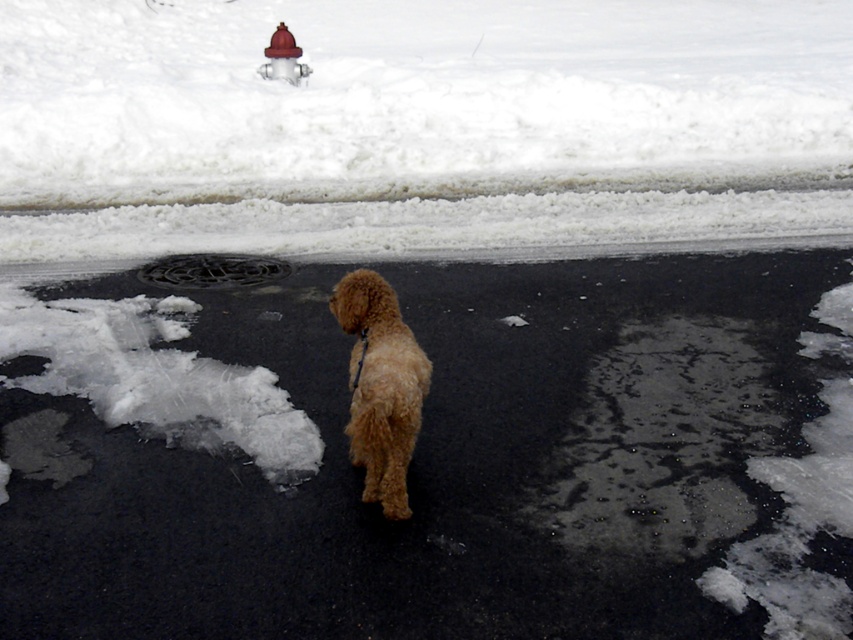
You are a dog owner who wants to ensure your brown furry dog at center can comfortably stand on the black rubber manhole cover at center. Based on the scene, can the dog fit on the manhole cover without any part of its body hanging off?

The brown furry dog at center is taller than the black rubber manhole cover at center, so it might not fit comfortably on the manhole cover without parts of its body hanging off.

You are standing at the point with coordinates point (171, 280) and want to walk to the point with coordinates point (364, 308). Which direction should you face to move towards your destination?

You should face towards the direction of point (364, 308), which is in front of point (171, 280), so you need to move forward in that direction.

You are a delivery robot with a 2.5 feet wide package. You need to move from the brown furry dog at center to the black rubber manhole cover at center. Can you fit through the space between them?

The brown furry dog at center is 5.19 feet away from the black rubber manhole cover at center. Since the package is 2.5 feet wide, there is enough space between them for the robot to navigate safely.